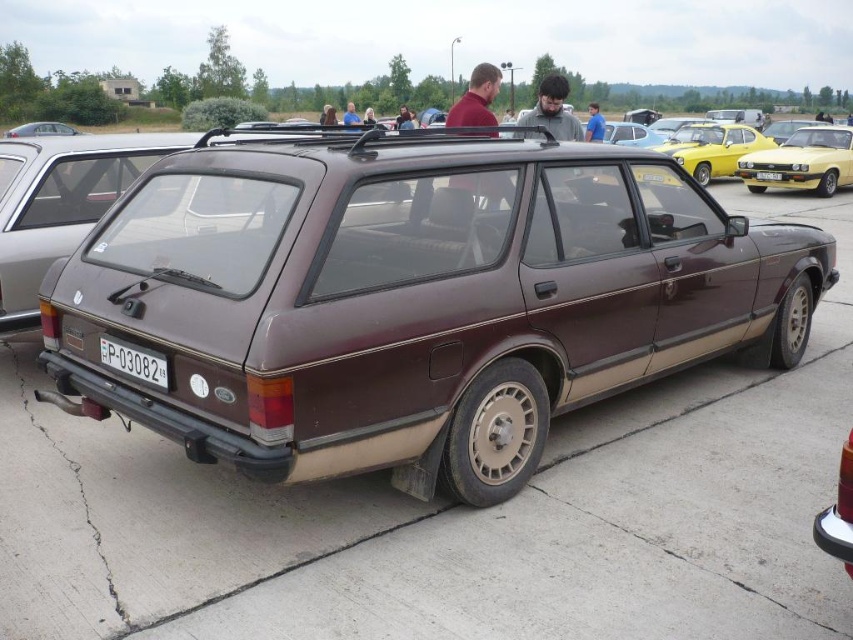
Question: Estimate the real-world distances between objects in this image. Which object is closer to the white plastic license plate at center?

Choices:
 (A) white plastic license plate at bottom center
 (B) yellow metallic car at right
 (C) maroon matte station wagon at center

Answer: (B)

Question: Among these objects, which one is farthest from the camera?

Choices:
 (A) white plastic license plate at bottom center
 (B) yellow metallic car at right
 (C) yellow glossy car at upper right
 (D) white plastic license plate at center

Answer: (C)

Question: Is maroon matte station wagon at center positioned before white plastic license plate at center?

Choices:
 (A) no
 (B) yes

Answer: (B)

Question: Observing the image, what is the correct spatial positioning of white plastic license plate at bottom center in reference to white plastic license plate at center?

Choices:
 (A) left
 (B) right

Answer: (A)

Question: In this image, where is maroon matte station wagon at center located relative to white plastic license plate at center?

Choices:
 (A) left
 (B) right

Answer: (A)

Question: Estimate the real-world distances between objects in this image. Which object is farther from the brown matte station wagon at center?

Choices:
 (A) white plastic license plate at bottom center
 (B) maroon matte station wagon at center
 (C) yellow glossy car at upper right
 (D) yellow metallic car at right

Answer: (A)